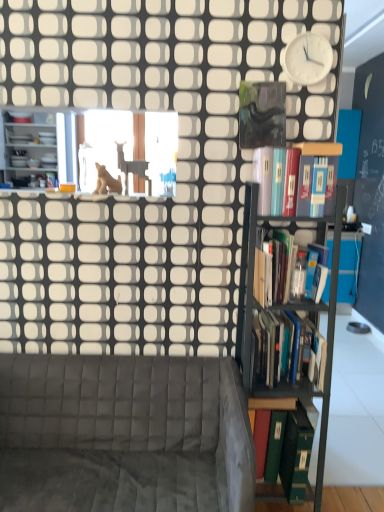
Question: Is white plastic clock at upper right with hardcover book at upper right, positioned as the first book in top-to-bottom order?

Choices:
 (A) yes
 (B) no

Answer: (B)

Question: Can you confirm if white plastic clock at upper right is taller than hardcover book at upper right, positioned as the first book in top-to-bottom order?

Choices:
 (A) no
 (B) yes

Answer: (A)

Question: From a real-world perspective, does white plastic clock at upper right stand above hardcover book at upper right, acting as the fourth book starting from the bottom?

Choices:
 (A) yes
 (B) no

Answer: (A)

Question: Is the depth of white plastic clock at upper right less than that of hardcover book at upper right, positioned as the first book in top-to-bottom order?

Choices:
 (A) yes
 (B) no

Answer: (B)

Question: Can you confirm if white plastic clock at upper right is wider than hardcover book at upper right, acting as the fourth book starting from the bottom?

Choices:
 (A) yes
 (B) no

Answer: (B)

Question: From a real-world perspective, is white plastic clock at upper right physically below hardcover book at upper right, acting as the fourth book starting from the bottom?

Choices:
 (A) yes
 (B) no

Answer: (B)

Question: Can you confirm if green matte book at right, the 1th book in the bottom-to-top sequence, is shorter than matte white shelves at left?

Choices:
 (A) no
 (B) yes

Answer: (B)

Question: Does green matte book at right, the 1th book in the bottom-to-top sequence, turn towards matte white shelves at left?

Choices:
 (A) yes
 (B) no

Answer: (B)

Question: From the image's perspective, does green matte book at right, the fourth book positioned from the top, appear lower than matte white shelves at left?

Choices:
 (A) no
 (B) yes

Answer: (B)

Question: Can we say green matte book at right, the 1th book in the bottom-to-top sequence, lies outside matte white shelves at left?

Choices:
 (A) no
 (B) yes

Answer: (B)

Question: Considering the relative sizes of green matte book at right, the fourth book positioned from the top, and matte white shelves at left in the image provided, is green matte book at right, the fourth book positioned from the top, taller than matte white shelves at left?

Choices:
 (A) no
 (B) yes

Answer: (A)

Question: Considering the relative sizes of green matte book at right, the 1th book in the bottom-to-top sequence, and matte white shelves at left in the image provided, is green matte book at right, the 1th book in the bottom-to-top sequence, bigger than matte white shelves at left?

Choices:
 (A) yes
 (B) no

Answer: (B)

Question: Is white plastic clock at upper right next to hardcover books at right, which is the 3th book in top-to-bottom order?

Choices:
 (A) yes
 (B) no

Answer: (B)